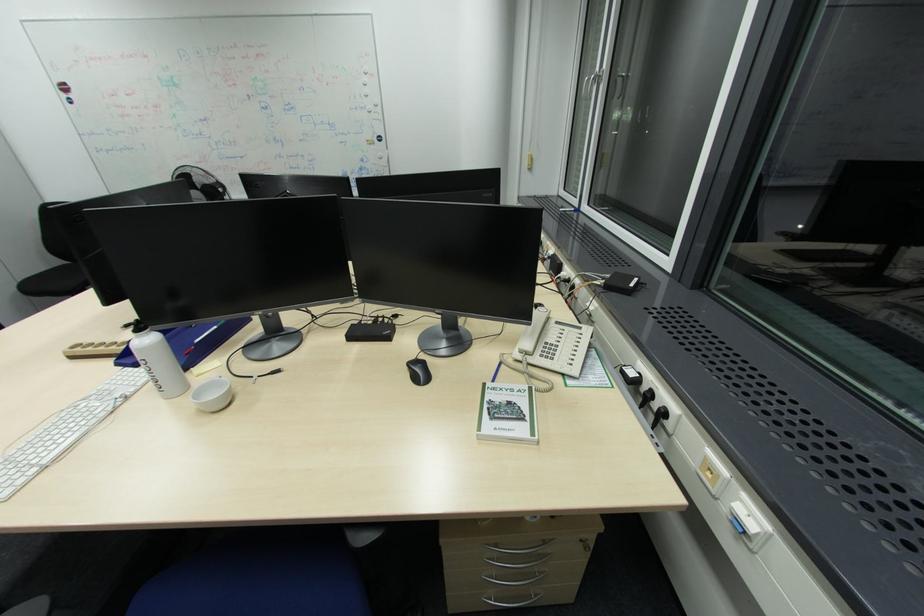
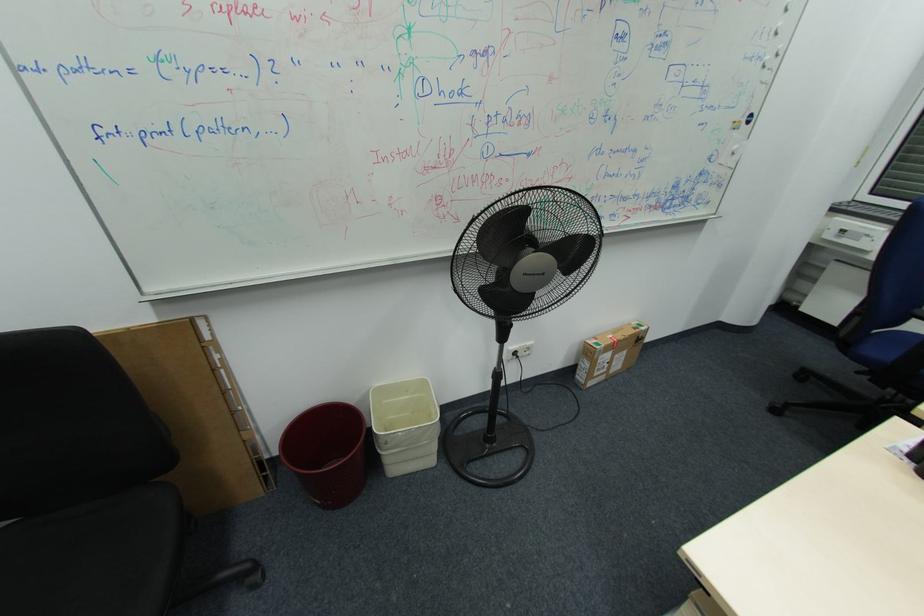
In a continuous first-person perspective shot, in which direction is the camera moving?

The movement direction of the cameraman is left, forward.